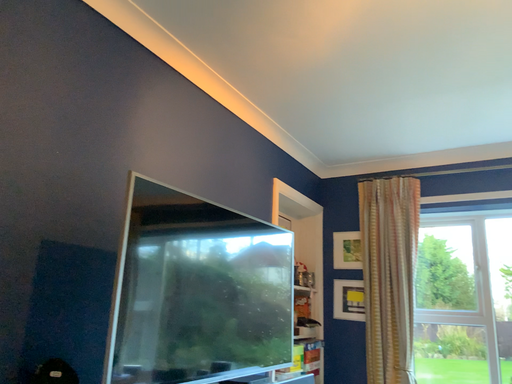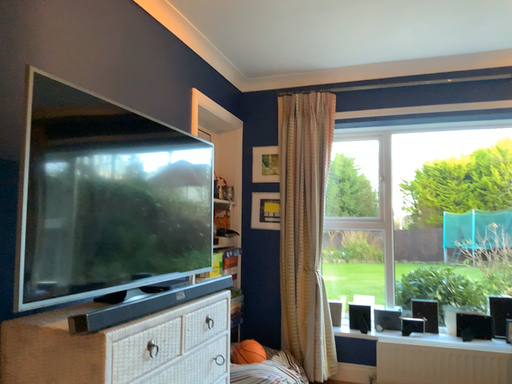
Question: How did the camera likely rotate when shooting the video?

Choices:
 (A) rotated right
 (B) rotated left

Answer: (A)